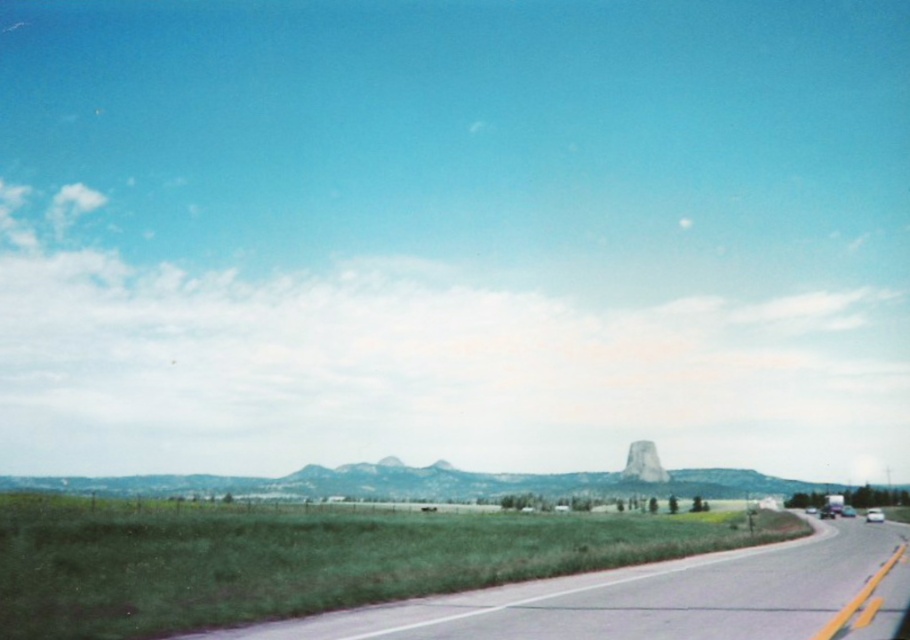
Question: Which point is farther from the camera taking this photo?

Choices:
 (A) (877, 520)
 (B) (627, 474)
 (C) (468, 630)

Answer: (B)

Question: Which of these objects is positioned farthest from the green stone butte at center?

Choices:
 (A) white glossy car at right
 (B) asphalt road at lower center

Answer: (B)

Question: In this image, where is asphalt road at lower center located relative to green stone butte at center?

Choices:
 (A) left
 (B) right

Answer: (A)

Question: Estimate the real-world distances between objects in this image. Which object is farther from the asphalt road at lower center?

Choices:
 (A) white glossy car at right
 (B) green stone butte at center

Answer: (B)

Question: Is asphalt road at lower center bigger than green stone butte at center?

Choices:
 (A) no
 (B) yes

Answer: (A)

Question: Is green stone butte at center closer to the viewer compared to white glossy car at right?

Choices:
 (A) yes
 (B) no

Answer: (B)